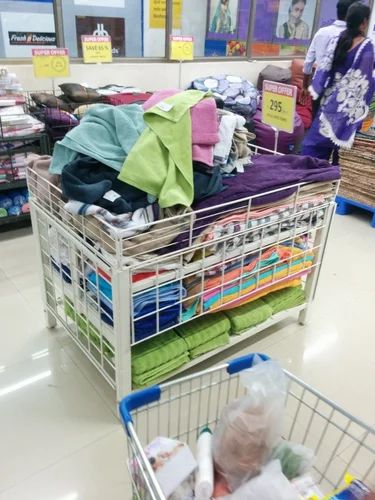
In order to click on white floor in this screenshot , I will do `click(337, 329)`.